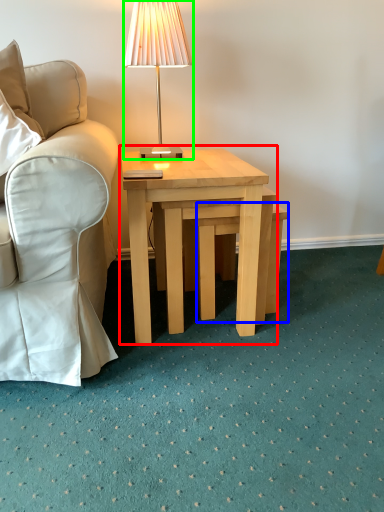
Question: Estimate the real-world distances between objects in this image. Which object is closer to coffee table (highlighted by a red box), stool (highlighted by a blue box) or lamp (highlighted by a green box)?

Choices:
 (A) stool
 (B) lamp

Answer: (A)